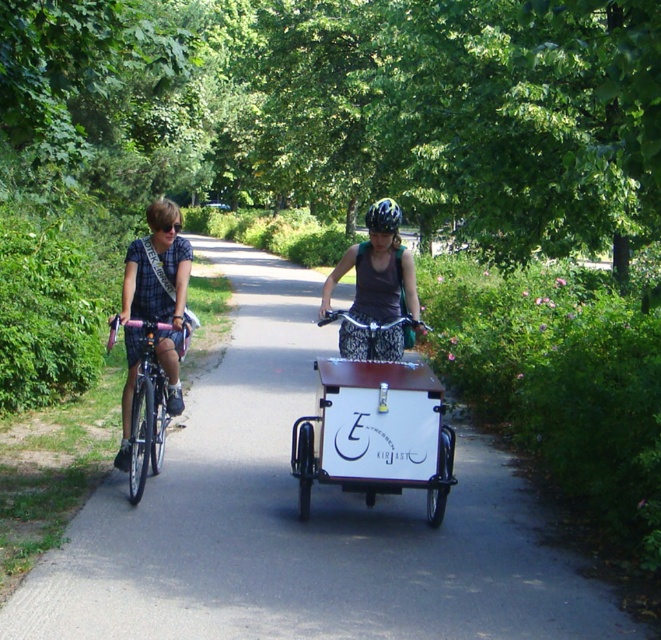
Question: Which object is the closest to the white matte cargo bike at center?

Choices:
 (A) blue patterned helmet at center
 (B) shiny metallic bicycle at left

Answer: (B)

Question: Which point appears closest to the camera in this image?

Choices:
 (A) (381, 212)
 (B) (132, 433)
 (C) (368, 332)

Answer: (A)

Question: Observing the image, what is the correct spatial positioning of white matte cargo bike at center in reference to matte purple tank top at center?

Choices:
 (A) below
 (B) above

Answer: (A)

Question: Can you confirm if shiny metallic bicycle at left is positioned above blue patterned helmet at center?

Choices:
 (A) no
 (B) yes

Answer: (A)

Question: Does matte purple tank top at center have a smaller size compared to blue patterned helmet at center?

Choices:
 (A) no
 (B) yes

Answer: (B)

Question: Which point is closer to the camera?

Choices:
 (A) blue patterned helmet at center
 (B) matte purple tank top at center

Answer: (B)